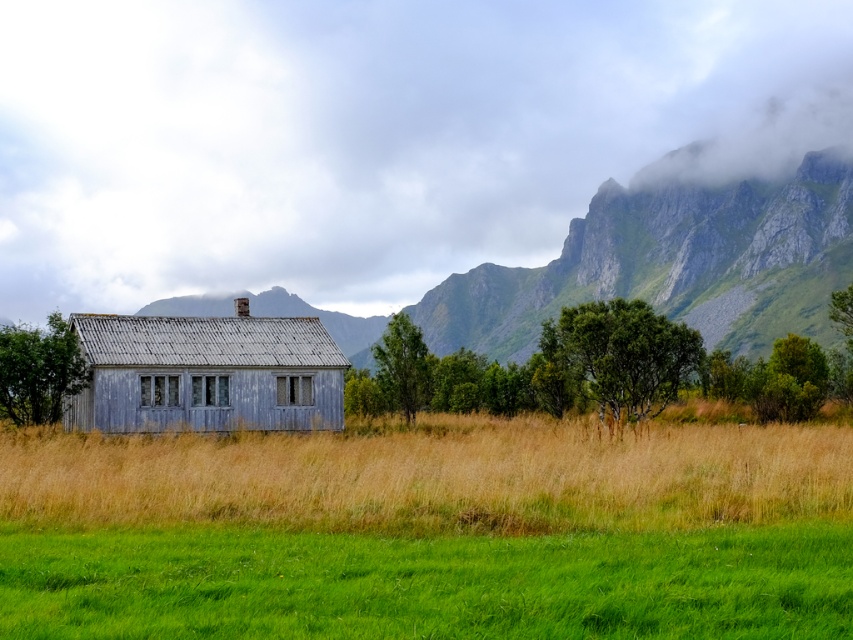
You are planning to build a small garden between the rugged stone mountain at center and the weathered wood hut at center. Considering their sizes, which object will require more space around it to accommodate the garden?

The rugged stone mountain at center has a larger size compared to the weathered wood hut at center, so it will require more space around it to accommodate the garden.

You are planning to set up a picnic area in the image. The grassy field at center and the weathered wood hut at center are both visible. Which location would provide more space for your picnic setup?

The grassy field at center is larger in size than the weathered wood hut at center, so it would provide more space for your picnic setup.